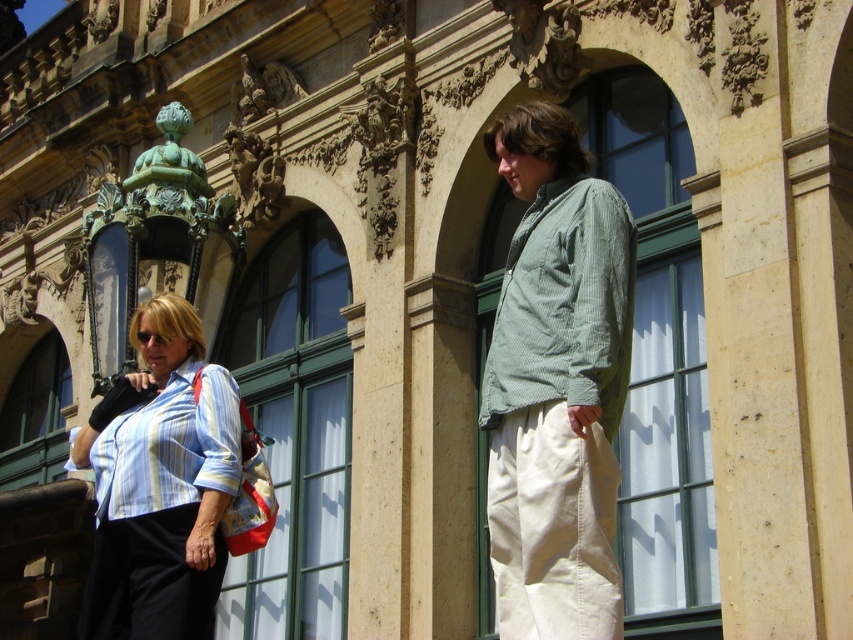
Which of these two, green corduroy shirt at upper right or striped cotton shirt at lower left, stands shorter?

striped cotton shirt at lower left

Who is more distant from viewer, (480, 397) or (142, 419)?

The point (480, 397) is more distant.

The height and width of the screenshot is (640, 853). What do you see at coordinates (564, 307) in the screenshot?
I see `green corduroy shirt at upper right` at bounding box center [564, 307].

Image resolution: width=853 pixels, height=640 pixels. What are the coordinates of `green corduroy shirt at upper right` in the screenshot? It's located at (564, 307).

Which of these two, striped cotton shirt at left or striped cotton shirt at lower left, stands shorter?

With less height is striped cotton shirt at lower left.

From the picture: Can you confirm if striped cotton shirt at left is smaller than striped cotton shirt at lower left?

Incorrect, striped cotton shirt at left is not smaller in size than striped cotton shirt at lower left.

Locate an element on the screen. striped cotton shirt at left is located at coordinates (160, 483).

Which is in front, point (549, 586) or point (119, 388)?

Point (549, 586) is in front.

Who is higher up, green corduroy shirt at center or striped cotton shirt at left?

green corduroy shirt at center

Describe the element at coordinates (556, 385) in the screenshot. The image size is (853, 640). I see `green corduroy shirt at center` at that location.

Where is `green corduroy shirt at center`? This screenshot has height=640, width=853. green corduroy shirt at center is located at coordinates (556, 385).